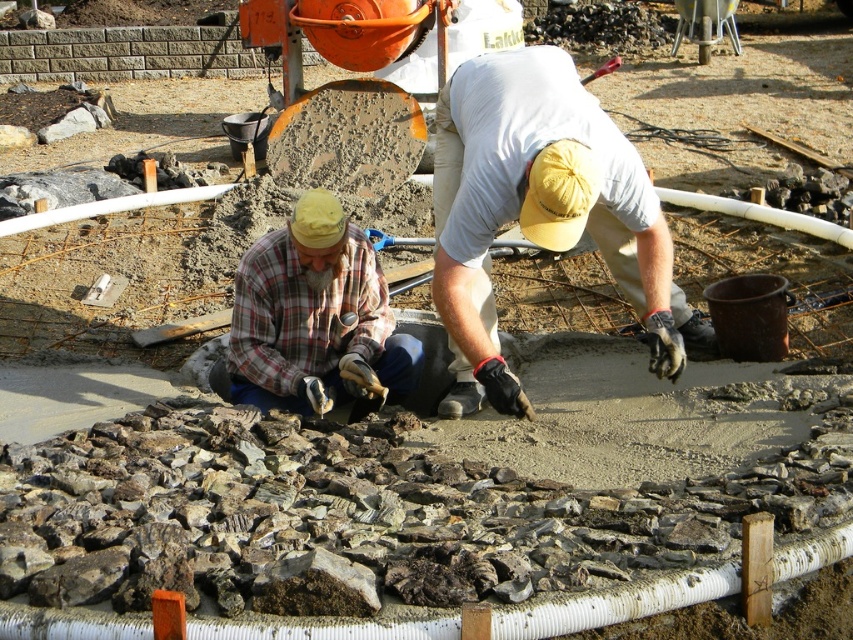
Question: Does light blue cotton shirt at center have a lesser width compared to plaid fabric shirt at center?

Choices:
 (A) no
 (B) yes

Answer: (A)

Question: Can you confirm if light blue cotton shirt at center is positioned to the right of plaid fabric shirt at center?

Choices:
 (A) yes
 (B) no

Answer: (A)

Question: Which point is closer to the camera?

Choices:
 (A) light blue cotton shirt at center
 (B) plaid fabric shirt at center

Answer: (A)

Question: Among these points, which one is farthest from the camera?

Choices:
 (A) (387, 344)
 (B) (611, 196)

Answer: (A)

Question: Is light blue cotton shirt at center wider than plaid fabric shirt at center?

Choices:
 (A) yes
 (B) no

Answer: (A)

Question: Which point is farther to the camera?

Choices:
 (A) light blue cotton shirt at center
 (B) plaid fabric shirt at center

Answer: (B)